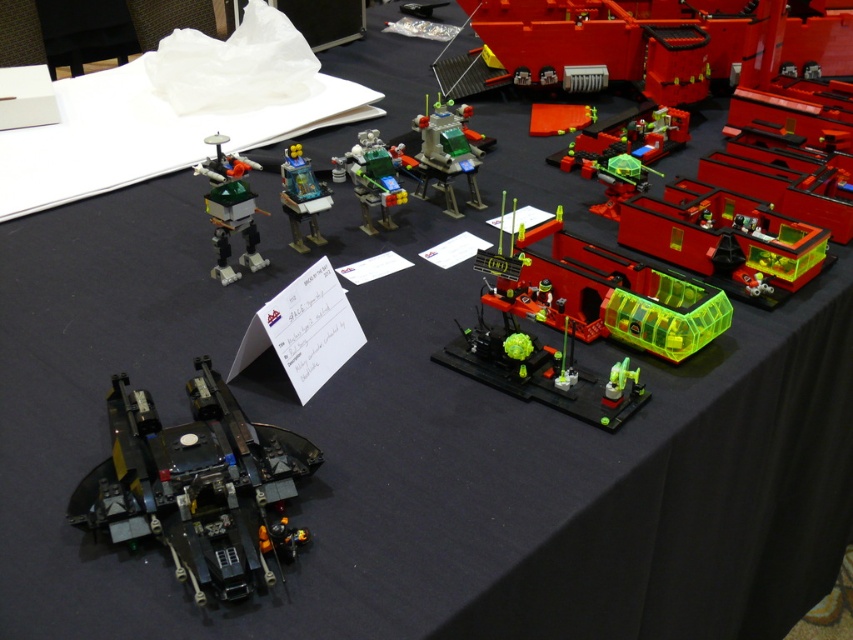
Which of these two, transparent plastic pod at center-right or translucent green plastic tank at upper right, stands shorter?

Standing shorter between the two is translucent green plastic tank at upper right.

Can you confirm if transparent plastic pod at center-right is positioned to the left of translucent green plastic tank at upper right?

Correct, you'll find transparent plastic pod at center-right to the left of translucent green plastic tank at upper right.

Measure the distance between point (627, 282) and camera.

Point (627, 282) is 1.10 meters away from camera.

Find the location of a particular element. This screenshot has height=640, width=853. transparent plastic pod at center-right is located at coordinates (604, 294).

Who is positioned more to the left, black matte spaceship at lower left or shiny green plastic robot at upper left?

Positioned to the left is shiny green plastic robot at upper left.

Is black matte spaceship at lower left to the left of shiny green plastic robot at upper left from the viewer's perspective?

In fact, black matte spaceship at lower left is to the right of shiny green plastic robot at upper left.

Is point (177, 540) farther from camera compared to point (247, 180)?

That is False.

Locate an element on the screen. The image size is (853, 640). black matte spaceship at lower left is located at coordinates (194, 483).

Is translucent green plastic tank at upper right below shiny green plastic robot at upper left?

Incorrect, translucent green plastic tank at upper right is not positioned below shiny green plastic robot at upper left.

Does translucent green plastic tank at upper right have a lesser width compared to shiny green plastic robot at upper left?

No.

What do you see at coordinates (625, 136) in the screenshot? I see `translucent green plastic tank at upper right` at bounding box center [625, 136].

Locate an element on the screen. The height and width of the screenshot is (640, 853). translucent green plastic tank at upper right is located at coordinates (625, 136).